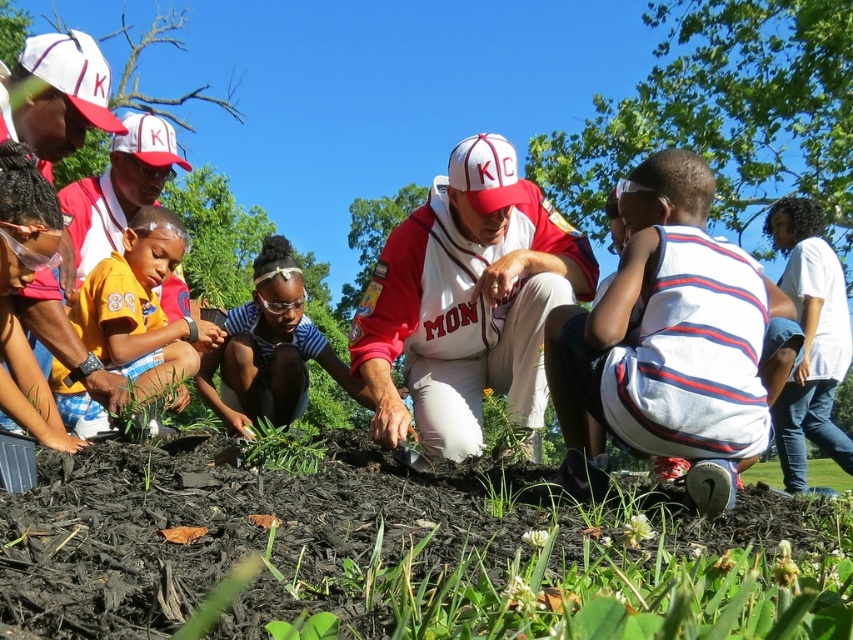
Question: Which point is closer to the camera taking this photo?

Choices:
 (A) (433, 232)
 (B) (722, 276)
 (C) (705, 120)
 (D) (288, 461)

Answer: (B)

Question: Can you confirm if green leafy tree at upper center is bigger than striped cotton shirt at center?

Choices:
 (A) no
 (B) yes

Answer: (B)

Question: Can you confirm if green leafy tree at upper center is thinner than green leafy plant at center?

Choices:
 (A) no
 (B) yes

Answer: (A)

Question: Which of the following is the farthest from the observer?

Choices:
 (A) green leafy tree at upper center
 (B) green leafy plant at center
 (C) white cotton shirt at center

Answer: (A)

Question: Which object is farther from the camera taking this photo?

Choices:
 (A) green leafy tree at upper center
 (B) green leafy plant at center
 (C) yellow jersey at left

Answer: (A)

Question: Can you confirm if white striped shirt at lower right is positioned above green leafy plant at center?

Choices:
 (A) no
 (B) yes

Answer: (B)